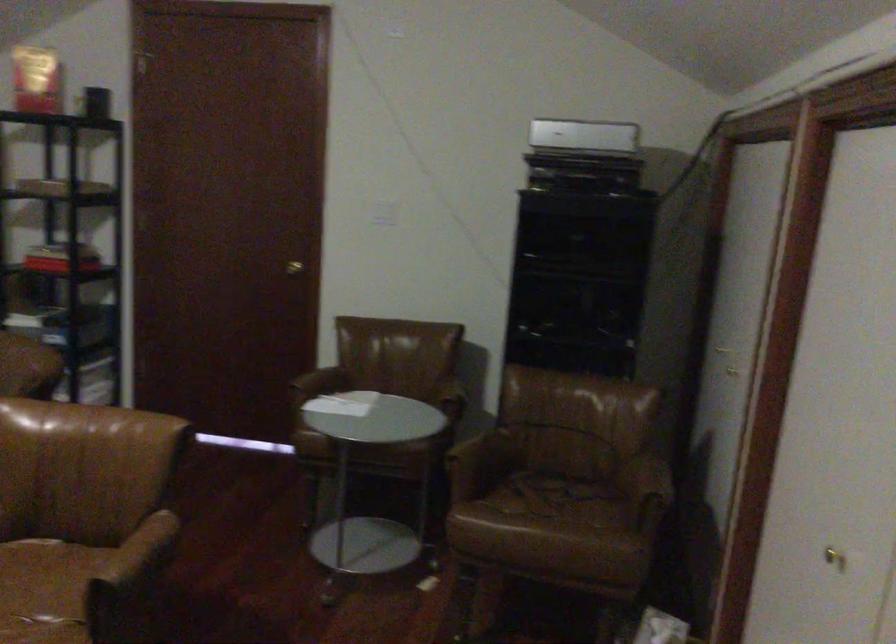
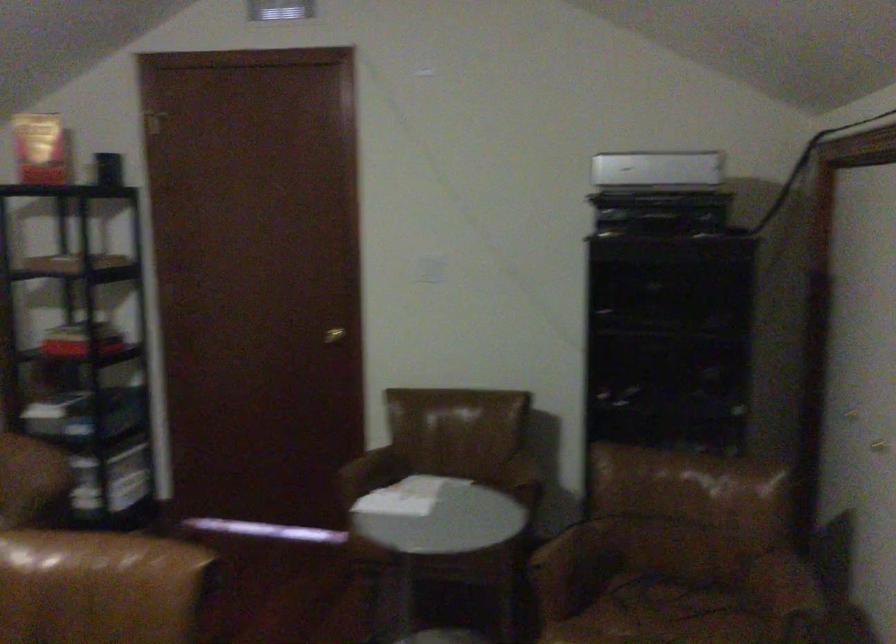
Question: The first image is from the beginning of the video and the second image is from the end. How did the camera likely rotate when shooting the video?

Choices:
 (A) Left
 (B) Right
 (C) Up
 (D) Down

Answer: (A)